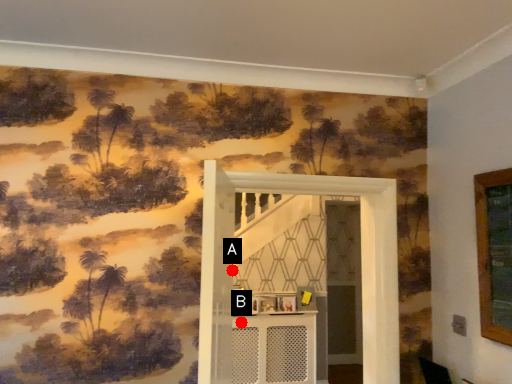
Question: Two points are circled on the image, labeled by A and B beside each circle. Which point is further to the camera?

Choices:
 (A) A is further
 (B) B is further

Answer: (B)